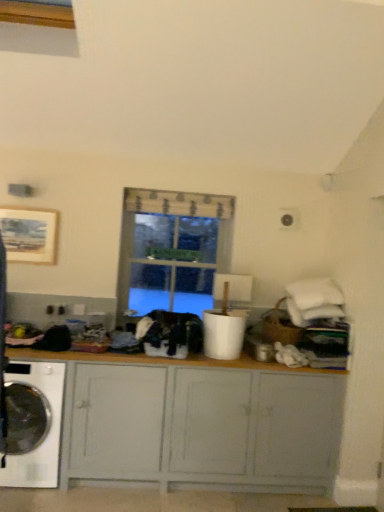
Describe the element at coordinates (46, 436) in the screenshot. The width and height of the screenshot is (384, 512). I see `white glossy washing machine at lower left` at that location.

What do you see at coordinates (171, 251) in the screenshot? I see `clear glass window at center` at bounding box center [171, 251].

What do you see at coordinates (170, 334) in the screenshot?
I see `black fabric at center` at bounding box center [170, 334].

The width and height of the screenshot is (384, 512). What are the coordinates of `white glossy washing machine at lower left` in the screenshot? It's located at (46, 436).

Is matte gray cabinet at center to the right of black fabric at center from the viewer's perspective?

Incorrect, matte gray cabinet at center is not on the right side of black fabric at center.

How many degrees apart are the facing directions of matte gray cabinet at center and black fabric at center?

0.23 degrees.

From the image's perspective, is matte gray cabinet at center below black fabric at center?

Yes, from the image's perspective, matte gray cabinet at center is beneath black fabric at center.

From a real-world perspective, between matte gray cabinet at center and black fabric at center, who is vertically lower?

matte gray cabinet at center is physically lower.

Is clear glass window at center completely or partially inside white glossy washing machine at lower left?

No, clear glass window at center is not surrounded by white glossy washing machine at lower left.

Considering the sizes of white glossy washing machine at lower left and clear glass window at center in the image, is white glossy washing machine at lower left wider or thinner than clear glass window at center?

Clearly, white glossy washing machine at lower left has more width compared to clear glass window at center.

From a real-world perspective, is white glossy washing machine at lower left located higher than clear glass window at center?

Incorrect, from a real-world perspective, white glossy washing machine at lower left is lower than clear glass window at center.

Is matte gray cabinet at center at the left side of white glossy washing machine at lower left?

No, matte gray cabinet at center is not to the left of white glossy washing machine at lower left.

Is matte gray cabinet at center next to white glossy washing machine at lower left and touching it?

matte gray cabinet at center and white glossy washing machine at lower left are not in contact.

In the scene shown: Is white glossy washing machine at lower left at the back of matte gray cabinet at center?

Yes, matte gray cabinet at center is positioned with its back facing white glossy washing machine at lower left.

Based on the photo, does black fabric at center have a larger size compared to matte gray cabinet at center?

Actually, black fabric at center might be smaller than matte gray cabinet at center.

From the image's perspective, relative to matte gray cabinet at center, is black fabric at center above or below?

Based on their image positions, black fabric at center is located above matte gray cabinet at center.

Considering the sizes of objects black fabric at center and matte gray cabinet at center in the image provided, who is shorter, black fabric at center or matte gray cabinet at center?

With less height is black fabric at center.

From a real-world perspective, does black fabric at center stand above matte gray cabinet at center?

Yes, from a real-world perspective, black fabric at center is over matte gray cabinet at center

Is matte gray cabinet at center at the right side of clear glass window at center?

No, matte gray cabinet at center is not to the right of clear glass window at center.

From the image's perspective, which object appears higher, matte gray cabinet at center or clear glass window at center?

clear glass window at center is shown above in the image.

Looking at this image, could you tell me if matte gray cabinet at center is turned towards clear glass window at center?

No, matte gray cabinet at center is not aimed at clear glass window at center.

How much distance is there between matte gray cabinet at center and clear glass window at center?

matte gray cabinet at center and clear glass window at center are 3.57 feet apart from each other.

From a real-world perspective, is clear glass window at center on white glossy washing machine at lower left?

Correct, in the physical world, clear glass window at center is higher than white glossy washing machine at lower left.

Find the location of `window to the right of white glossy washing machine at lower left`. window to the right of white glossy washing machine at lower left is located at coordinates (171, 251).

Which of these two, white glossy washing machine at lower left or matte gray cabinet at center, is bigger?

With larger size is matte gray cabinet at center.

Can we say white glossy washing machine at lower left lies outside matte gray cabinet at center?

No, most part of white glossy washing machine at lower left lies within matte gray cabinet at center.

In the scene shown: Is white glossy washing machine at lower left facing towards matte gray cabinet at center?

Yes.

The image size is (384, 512). I want to click on clothing behind the matte gray cabinet at center, so click(x=170, y=334).

You are a GUI agent. You are given a task and a screenshot of the screen. Output one action in this format:
    pyautogui.click(x=<x>, y=<y>)
    Task: Click on the window above the white glossy washing machine at lower left (from a real-world perspective)
    
    Given the screenshot: What is the action you would take?
    [171, 251]

When comparing their distances from matte gray cabinet at center, does white glossy washing machine at lower left or black fabric at center seem further?

The object further to matte gray cabinet at center is white glossy washing machine at lower left.

From the image, which object appears to be nearer to clear glass window at center, matte gray cabinet at center or black fabric at center?

black fabric at center.

Based on their spatial positions, is black fabric at center or matte gray cabinet at center closer to clear glass window at center?

Among the two, black fabric at center is located nearer to clear glass window at center.

Which object lies nearer to the anchor point black fabric at center, clear glass window at center or white glossy washing machine at lower left?

white glossy washing machine at lower left is positioned closer to the anchor black fabric at center.

Based on their spatial positions, is matte gray cabinet at center or white glossy washing machine at lower left further from black fabric at center?

Based on the image, white glossy washing machine at lower left appears to be further to black fabric at center.

Based on their spatial positions, is white glossy washing machine at lower left or clear glass window at center further from matte gray cabinet at center?

clear glass window at center is positioned further to the anchor matte gray cabinet at center.

Estimate the real-world distances between objects in this image. Which object is closer to black fabric at center, matte gray cabinet at center or clear glass window at center?

matte gray cabinet at center is positioned closer to the anchor black fabric at center.

Which object lies further to the anchor point clear glass window at center, matte gray cabinet at center or white glossy washing machine at lower left?

white glossy washing machine at lower left is further to clear glass window at center.

Find the location of a particular element. cabinetry between white glossy washing machine at lower left and black fabric at center from left to right is located at coordinates (198, 422).

Image resolution: width=384 pixels, height=512 pixels. I want to click on washing machine between clear glass window at center and matte gray cabinet at center from top to bottom, so [x=46, y=436].

This screenshot has width=384, height=512. Identify the location of clothing between white glossy washing machine at lower left and clear glass window at center from left to right. (170, 334).

You are a GUI agent. You are given a task and a screenshot of the screen. Output one action in this format:
    pyautogui.click(x=<x>, y=<y>)
    Task: Click on the clothing that lies between clear glass window at center and matte gray cabinet at center from top to bottom
    This screenshot has height=512, width=384.
    Given the screenshot: What is the action you would take?
    point(170,334)